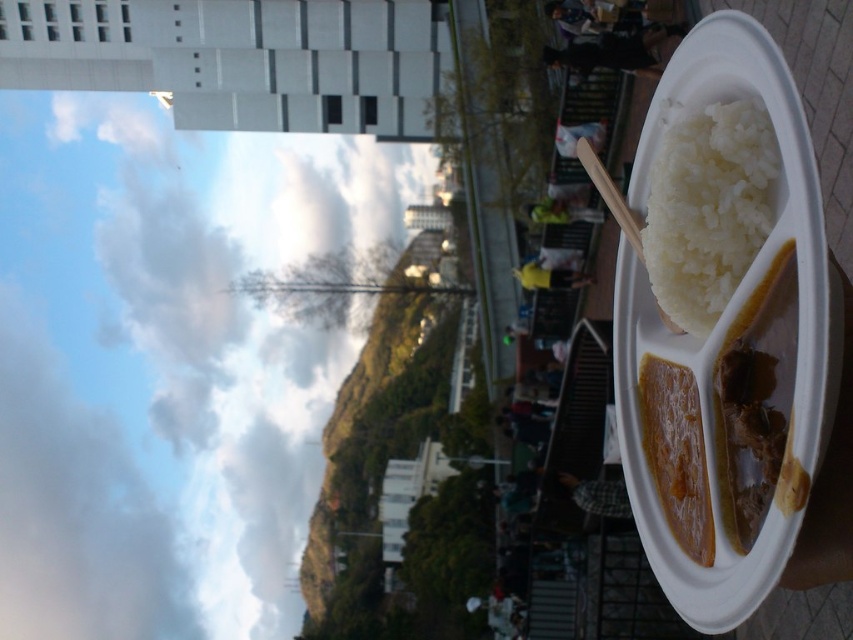
Who is more forward, (643, 378) or (567, 280)?

Point (643, 378) is more forward.

Which is behind, point (697, 474) or point (572, 278)?

The point (572, 278) is behind.

Does point (689, 492) lie behind point (523, 264)?

No, it is not.

Image resolution: width=853 pixels, height=640 pixels. Identify the location of brown glossy curry at upper right. (676, 452).

Is point (724, 230) positioned behind point (625, 509)?

No, it is in front of (625, 509).

The height and width of the screenshot is (640, 853). What do you see at coordinates (708, 209) in the screenshot?
I see `white matte rice at upper right` at bounding box center [708, 209].

Locate an element on the screen. The height and width of the screenshot is (640, 853). white matte rice at upper right is located at coordinates 708,209.

Is brown glossy meat at upper right thinner than green fabric bag at center?

Indeed, brown glossy meat at upper right has a lesser width compared to green fabric bag at center.

Is brown glossy meat at upper right positioned before green fabric bag at center?

Yes, brown glossy meat at upper right is closer to the viewer.

Does point (762, 483) come farther from viewer compared to point (544, 214)?

That is False.

At what (x,y) coordinates should I click in order to perform the action: click on brown glossy meat at upper right. Please return your answer as a coordinate pair (x, y). The height and width of the screenshot is (640, 853). Looking at the image, I should click on (753, 401).